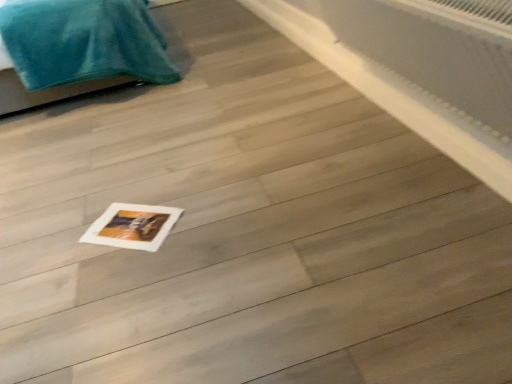
Locate an element on the screen. The image size is (512, 384). vacant space situated on the left part of white glossy magazine at center is located at coordinates (65, 240).